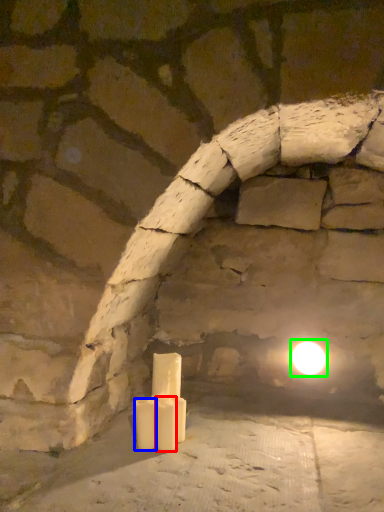
Question: Which is nearer to the candle (highlighted by a red box)? candle (highlighted by a blue box) or moonlight (highlighted by a green box).

Choices:
 (A) candle
 (B) moonlight

Answer: (A)